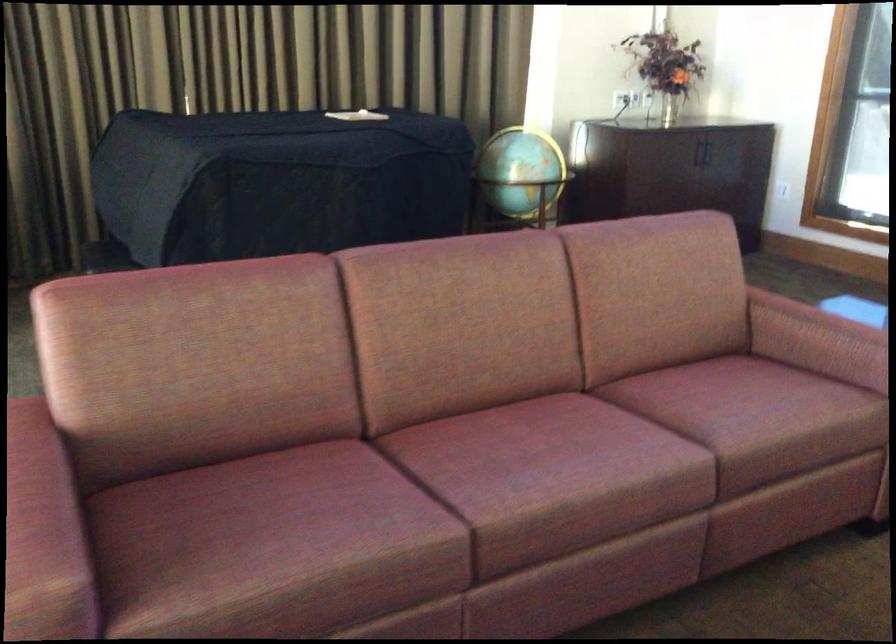
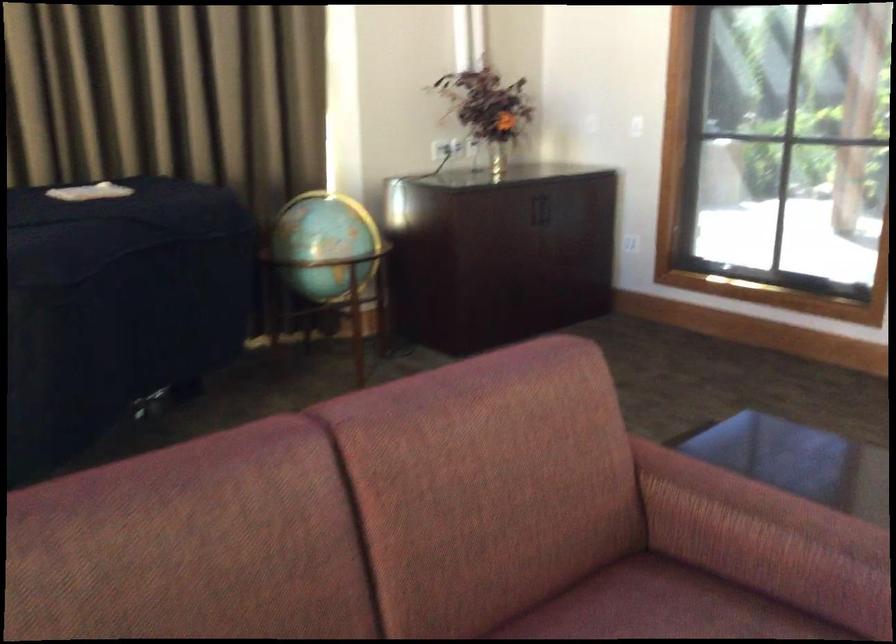
Question: The camera is either moving clockwise (left) or counter-clockwise (right) around the object. The first image is from the beginning of the video and the second image is from the end. Is the camera moving left or right when shooting the video?

Choices:
 (A) Left
 (B) Right

Answer: (A)